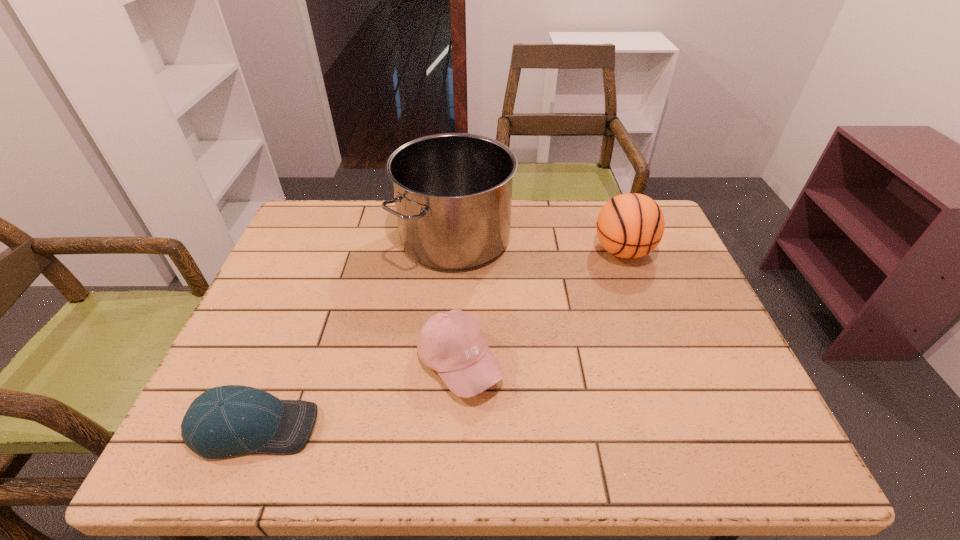
What are the coordinates of `saucepan that is at the far edge` in the screenshot? It's located at (452, 192).

The width and height of the screenshot is (960, 540). Identify the location of basketball that is at the far edge. (631, 225).

Locate an element on the screen. This screenshot has height=540, width=960. object present at the near edge is located at coordinates (224, 421).

Image resolution: width=960 pixels, height=540 pixels. What are the coordinates of `object present at the left edge` in the screenshot? It's located at (224, 421).

At what (x,y) coordinates should I click in order to perform the action: click on object positioned at the right edge. Please return your answer as a coordinate pair (x, y). Looking at the image, I should click on (631, 225).

I want to click on object that is positioned at the near left corner, so click(x=224, y=421).

This screenshot has height=540, width=960. Find the location of `object at the far right corner`. object at the far right corner is located at coordinates (631, 225).

Find the location of a particular element. vacant area at the far edge of the desktop is located at coordinates (371, 214).

Where is `free spot at the near edge of the desktop`? free spot at the near edge of the desktop is located at coordinates point(466,436).

Find the location of a particular element. The image size is (960, 540). vacant space at the left edge is located at coordinates point(313,287).